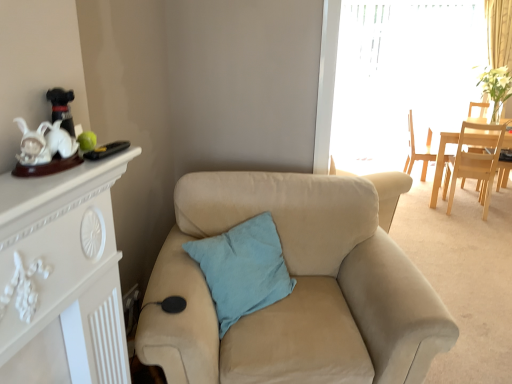
Image resolution: width=512 pixels, height=384 pixels. I want to click on beige fabric armchair at center, so click(503, 172).

I want to click on light wood chair at upper right, marked as the second chair in a front-to-back arrangement, so click(x=418, y=152).

You are a GUI agent. You are given a task and a screenshot of the screen. Output one action in this format:
    pyautogui.click(x=<x>, y=<y>)
    Task: Click on the light wood chair at right, the second chair positioned from the back
    This screenshot has width=512, height=384.
    Given the screenshot: What is the action you would take?
    pyautogui.click(x=475, y=159)

You are a GUI agent. You are given a task and a screenshot of the screen. Output one action in this format:
    pyautogui.click(x=<x>, y=<y>)
    Task: Click on the light blue cotton pillow at center
    
    Given the screenshot: What is the action you would take?
    pyautogui.click(x=243, y=269)

Could you tell me if light wood chair at upper right, which is the first chair in back-to-front order, is turned towards transparent plastic window screen at upper right?

No, light wood chair at upper right, which is the first chair in back-to-front order, is not aimed at transparent plastic window screen at upper right.

Is light wood chair at upper right, marked as the second chair in a front-to-back arrangement, at the left side of transparent plastic window screen at upper right?

Yes.

Is light wood chair at upper right, marked as the second chair in a front-to-back arrangement, further to camera compared to transparent plastic window screen at upper right?

No, light wood chair at upper right, marked as the second chair in a front-to-back arrangement, is closer to the camera.

Based on the photo, from their relative heights in the image, would you say light wood chair at upper right, marked as the second chair in a front-to-back arrangement, is taller or shorter than transparent plastic window screen at upper right?

Considering their sizes, light wood chair at upper right, marked as the second chair in a front-to-back arrangement, has less height than transparent plastic window screen at upper right.

Which of these two, light blue cotton pillow at center or light wood chair at right, which is the first chair from front to back, is wider?

Wider between the two is light wood chair at right, which is the first chair from front to back.

From the picture: Would you say light blue cotton pillow at center is to the left or to the right of light wood chair at right, the second chair positioned from the back, in the picture?

light blue cotton pillow at center is positioned on light wood chair at right, the second chair positioned from the back,'s left side.

From a real-world perspective, is light blue cotton pillow at center below light wood chair at right, the second chair positioned from the back?

No, from a real-world perspective, light blue cotton pillow at center is not under light wood chair at right, the second chair positioned from the back.

Would you say light blue cotton pillow at center contains light wood chair at right, the second chair positioned from the back?

No, light wood chair at right, the second chair positioned from the back, is located outside of light blue cotton pillow at center.

Considering the relative positions of beige fabric armchair at center and beige fabric couch at center in the image provided, is beige fabric armchair at center to the left of beige fabric couch at center from the viewer's perspective?

Incorrect, beige fabric armchair at center is not on the left side of beige fabric couch at center.

How much distance is there between beige fabric armchair at center and beige fabric couch at center?

beige fabric armchair at center is 9.30 feet away from beige fabric couch at center.

Does point (510, 162) lie in front of point (350, 177)?

No, (510, 162) is behind (350, 177).

Would you say beige fabric armchair at center is a long distance from beige fabric couch at center?

Yes, beige fabric armchair at center is far from beige fabric couch at center.

Considering the sizes of objects teal fabric pillow at center and beige fabric armchair at center in the image provided, who is bigger, teal fabric pillow at center or beige fabric armchair at center?

beige fabric armchair at center.

Does teal fabric pillow at center appear on the right side of beige fabric armchair at center?

Incorrect, teal fabric pillow at center is not on the right side of beige fabric armchair at center.

Between point (83, 148) and point (499, 164), which one is positioned in front?

The point (83, 148) is closer.

Is beige fabric couch at center outside of light wood chair at right, which is the first chair from front to back?

Yes.

Identify the location of the 1st chair behind when counting from the beige fabric couch at center. The height and width of the screenshot is (384, 512). (475, 159).

Is beige fabric couch at center turned away from light wood chair at right, the second chair positioned from the back?

That's not correct — beige fabric couch at center is not looking away from light wood chair at right, the second chair positioned from the back.

Is beige fabric couch at center beside light wood chair at right, which is the first chair from front to back?

No, beige fabric couch at center is not making contact with light wood chair at right, which is the first chair from front to back.

Considering the relative sizes of beige fabric couch at center and transparent plastic window screen at upper right in the image provided, is beige fabric couch at center thinner than transparent plastic window screen at upper right?

No.

Is beige fabric couch at center aimed at transparent plastic window screen at upper right?

No, beige fabric couch at center is not turned towards transparent plastic window screen at upper right.

Does beige fabric couch at center come behind transparent plastic window screen at upper right?

No, it is in front of transparent plastic window screen at upper right.

I want to click on the 1st chair above the teal fabric pillow at center (from the image's perspective), so click(x=475, y=159).

Which object is wider, teal fabric pillow at center or light wood chair at right, which is the first chair from front to back?

Wider between the two is light wood chair at right, which is the first chair from front to back.

Does teal fabric pillow at center have a lesser height compared to light wood chair at right, the second chair positioned from the back?

Yes, teal fabric pillow at center is shorter than light wood chair at right, the second chair positioned from the back.

Can you confirm if teal fabric pillow at center is positioned to the right of light wood chair at right, the second chair positioned from the back?

No.

Where is `window screen that is above the light wood chair at upper right, which is the first chair in back-to-front order (from the image's perspective)`? window screen that is above the light wood chair at upper right, which is the first chair in back-to-front order (from the image's perspective) is located at coordinates (401, 75).

Image resolution: width=512 pixels, height=384 pixels. In order to click on pillow positioned vertically above the light wood chair at right, the second chair positioned from the back (from a real-world perspective) in this screenshot , I will do `click(243, 269)`.

From the image, which object appears to be nearer to light wood chair at right, which is the first chair from front to back, light wood chair at upper right, marked as the second chair in a front-to-back arrangement, or beige fabric armchair at center?

beige fabric armchair at center lies closer to light wood chair at right, which is the first chair from front to back, than the other object.

Which object lies further to the anchor point teal fabric pillow at center, light wood chair at right, which is the first chair from front to back, or beige fabric armchair at center?

Among the two, beige fabric armchair at center is located further to teal fabric pillow at center.

Considering their positions, is light blue cotton pillow at center positioned closer to teal fabric pillow at center than light wood chair at right, which is the first chair from front to back?

light blue cotton pillow at center.

Looking at the image, which one is located closer to teal fabric pillow at center, beige fabric armchair at center or beige fabric couch at center?

beige fabric couch at center is closer to teal fabric pillow at center.

Based on the photo, estimate the real-world distances between objects in this image. Which object is further from beige fabric armchair at center, light blue cotton pillow at center or teal fabric pillow at center?

Among the two, teal fabric pillow at center is located further to beige fabric armchair at center.

Consider the image. From the image, which object appears to be nearer to teal fabric pillow at center, light blue cotton pillow at center or beige fabric armchair at center?

light blue cotton pillow at center is closer to teal fabric pillow at center.

Based on the photo, when comparing their distances from teal fabric pillow at center, does light wood chair at upper right, marked as the second chair in a front-to-back arrangement, or light blue cotton pillow at center seem further?

light wood chair at upper right, marked as the second chair in a front-to-back arrangement, is positioned further to the anchor teal fabric pillow at center.

When comparing their distances from beige fabric armchair at center, does teal fabric pillow at center or light blue cotton pillow at center seem further?

teal fabric pillow at center is positioned further to the anchor beige fabric armchair at center.

Where is `pillow located between teal fabric pillow at center and beige fabric armchair at center in the left-right direction`? pillow located between teal fabric pillow at center and beige fabric armchair at center in the left-right direction is located at coordinates (243, 269).

This screenshot has width=512, height=384. Find the location of `chair between transparent plastic window screen at upper right and beige fabric armchair at center vertically`. chair between transparent plastic window screen at upper right and beige fabric armchair at center vertically is located at coordinates (418, 152).

Locate an element on the screen. This screenshot has width=512, height=384. studio couch between light blue cotton pillow at center and beige fabric armchair at center from left to right is located at coordinates (296, 288).

The height and width of the screenshot is (384, 512). I want to click on pillow located between beige fabric couch at center and light wood chair at right, which is the first chair from front to back, in the depth direction, so click(x=243, y=269).